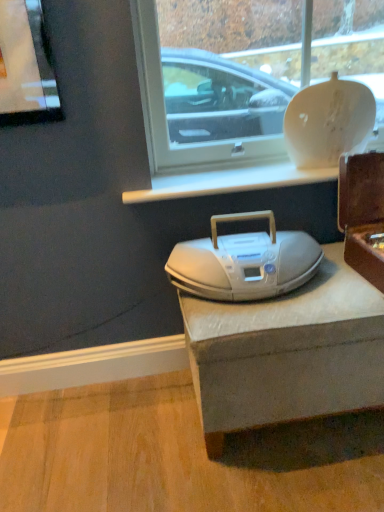
This screenshot has height=512, width=384. I want to click on white glossy vase at upper center, so click(211, 94).

Find the location of `white plastic boombox at center`. white plastic boombox at center is located at coordinates (244, 262).

From the image's perspective, is white glossy vase at upper center located above white plastic boombox at center?

Yes, from the image's perspective, white glossy vase at upper center is above white plastic boombox at center.

Which is correct: white glossy vase at upper center is inside white plastic boombox at center, or outside of it?

white glossy vase at upper center is located beyond the bounds of white plastic boombox at center.

Is point (236, 81) behind point (307, 258)?

Yes, it is.

How many degrees apart are the facing directions of white glossy vase at upper center and white plastic boombox at center?

0.337 degrees separate the facing orientations of white glossy vase at upper center and white plastic boombox at center.

From the picture: Between white plastic boombox at center and white glossy vase at upper center, which one is positioned in front?

white plastic boombox at center is in front.

Is white plastic boombox at center placed right next to white glossy vase at upper center?

No, white plastic boombox at center is not next to white glossy vase at upper center.

Does white plastic boombox at center have a lesser height compared to white glossy vase at upper center?

Indeed, white plastic boombox at center has a lesser height compared to white glossy vase at upper center.

Does white glossy vase at upper center turn towards brown wooden box at right?

Yes, white glossy vase at upper center is turned towards brown wooden box at right.

Considering the relative sizes of white glossy vase at upper center and brown wooden box at right in the image provided, is white glossy vase at upper center shorter than brown wooden box at right?

Incorrect, the height of white glossy vase at upper center does not fall short of that of brown wooden box at right.

Between white glossy vase at upper center and brown wooden box at right, which one has larger size?

white glossy vase at upper center is bigger.

Considering the relative positions of white glossy vase at upper center and brown wooden box at right in the image provided, is white glossy vase at upper center to the left or to the right of brown wooden box at right?

In the image, white glossy vase at upper center appears on the left side of brown wooden box at right.

Is brown wooden box at right spatially inside white glossy vase at upper center, or outside of it?

brown wooden box at right is spatially situated outside white glossy vase at upper center.

Considering the positions of point (357, 263) and point (286, 48), is point (357, 263) closer or farther from the camera than point (286, 48)?

Point (357, 263) is positioned closer to the camera compared to point (286, 48).

From the image's perspective, who appears lower, brown wooden box at right or white glossy vase at upper center?

brown wooden box at right.

From a real-world perspective, is brown wooden box at right beneath white glossy vase at upper center?

Yes.

Is white plastic boombox at center positioned behind brown wooden box at right?

Yes, the depth of white plastic boombox at center is greater than that of brown wooden box at right.

From a real-world perspective, which is physically below, white plastic boombox at center or brown wooden box at right?

In real-world perspective, white plastic boombox at center is lower.

From the image's perspective, between white plastic boombox at center and brown wooden box at right, which one is located above?

brown wooden box at right.

Is white plastic boombox at center spatially inside brown wooden box at right, or outside of it?

The correct answer is: outside.

Which object is positioned more to the left, brown wooden box at right or white plastic boombox at center?

From the viewer's perspective, white plastic boombox at center appears more on the left side.

In the scene shown: From the image's perspective, relative to white plastic boombox at center, is brown wooden box at right above or below?

Clearly, from the image's perspective, brown wooden box at right is above white plastic boombox at center.

Identify the location of box on the right side of white plastic boombox at center. (363, 214).

Can you tell me how much brown wooden box at right and white plastic boombox at center differ in facing direction?

They differ by 0.117 degrees in their facing directions.

Identify the location of window that appears above the white plastic boombox at center (from a real-world perspective). The width and height of the screenshot is (384, 512). (211, 94).

The image size is (384, 512). In the image, there is a white glossy vase at upper center. What are the coordinates of `appliance below it (from the image's perspective)` in the screenshot? It's located at (244, 262).

From the image, which object appears to be farther from brown wooden box at right, white plastic boombox at center or white glossy vase at upper center?

Among the two, white glossy vase at upper center is located further to brown wooden box at right.

Looking at the image, which one is located closer to white glossy vase at upper center, white plastic boombox at center or brown wooden box at right?

Based on the image, brown wooden box at right appears to be nearer to white glossy vase at upper center.

Considering their positions, is white glossy vase at upper center positioned further to white plastic boombox at center than brown wooden box at right?

The object further to white plastic boombox at center is white glossy vase at upper center.

Based on their spatial positions, is brown wooden box at right or white plastic boombox at center further from white glossy vase at upper center?

The object further to white glossy vase at upper center is white plastic boombox at center.

Estimate the real-world distances between objects in this image. Which object is closer to brown wooden box at right, white glossy vase at upper center or white plastic boombox at center?

white plastic boombox at center is closer to brown wooden box at right.

Which object lies further to the anchor point white plastic boombox at center, brown wooden box at right or white glossy vase at upper center?

Among the two, white glossy vase at upper center is located further to white plastic boombox at center.

Locate an element on the screen. box between white glossy vase at upper center and white plastic boombox at center vertically is located at coordinates (363, 214).